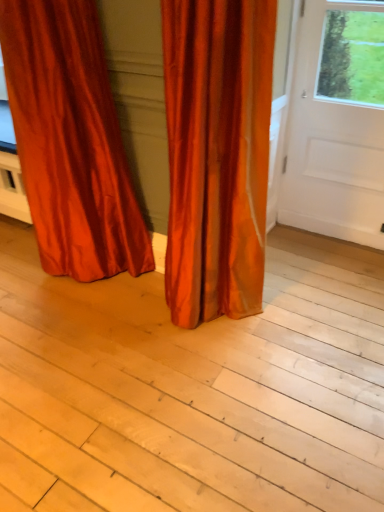
Where is `free region under satin orange curtain at lower left, which ranks as the 1th curtain in left-to-right order (from a real-world perspective)`? free region under satin orange curtain at lower left, which ranks as the 1th curtain in left-to-right order (from a real-world perspective) is located at coordinates (94, 287).